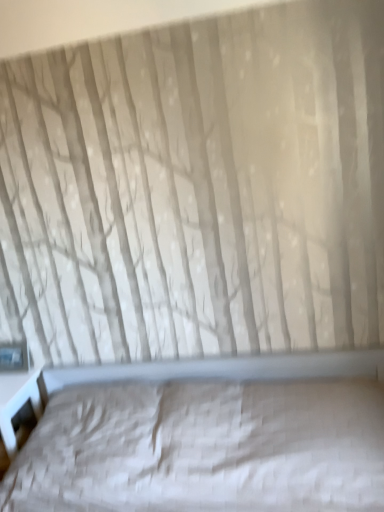
Question: Is white quilted bed at center wider than transparent glass window at lower left?

Choices:
 (A) no
 (B) yes

Answer: (B)

Question: Is white quilted bed at center positioned before transparent glass window at lower left?

Choices:
 (A) no
 (B) yes

Answer: (B)

Question: From the image's perspective, would you say white quilted bed at center is positioned over transparent glass window at lower left?

Choices:
 (A) yes
 (B) no

Answer: (B)

Question: Is white quilted bed at center bigger than transparent glass window at lower left?

Choices:
 (A) yes
 (B) no

Answer: (A)

Question: Is white quilted bed at center at the left side of transparent glass window at lower left?

Choices:
 (A) no
 (B) yes

Answer: (A)

Question: Is white quilted bed at center turned away from transparent glass window at lower left?

Choices:
 (A) no
 (B) yes

Answer: (A)

Question: Could you tell me if transparent glass window at lower left is turned towards white quilted bed at center?

Choices:
 (A) no
 (B) yes

Answer: (A)

Question: Can you confirm if transparent glass window at lower left is positioned to the right of white quilted bed at center?

Choices:
 (A) no
 (B) yes

Answer: (A)

Question: Is transparent glass window at lower left completely or partially outside of white quilted bed at center?

Choices:
 (A) yes
 (B) no

Answer: (A)

Question: Can you confirm if transparent glass window at lower left is shorter than white quilted bed at center?

Choices:
 (A) yes
 (B) no

Answer: (A)

Question: Does transparent glass window at lower left have a greater height compared to white quilted bed at center?

Choices:
 (A) no
 (B) yes

Answer: (A)

Question: Considering the relative sizes of transparent glass window at lower left and white quilted bed at center in the image provided, is transparent glass window at lower left smaller than white quilted bed at center?

Choices:
 (A) no
 (B) yes

Answer: (B)

Question: Based on their positions, is transparent glass window at lower left located to the left or right of white quilted bed at center?

Choices:
 (A) right
 (B) left

Answer: (B)